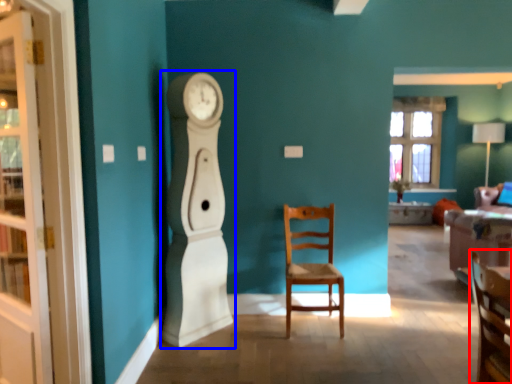
Question: Which point is further to the camera, chair (highlighted by a red box) or clock (highlighted by a blue box)?

Choices:
 (A) chair
 (B) clock

Answer: (B)